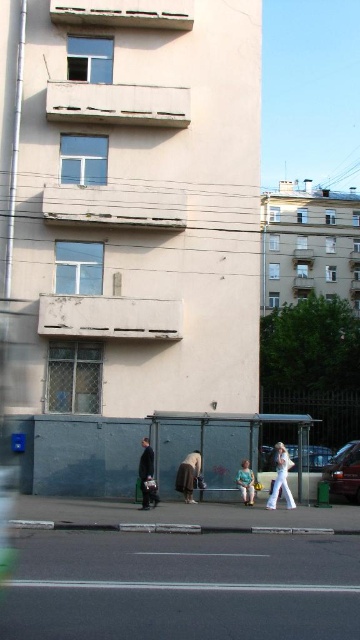
Does metallic silver bus stop at center have a smaller size compared to light blue denim jeans at lower center?

Incorrect, metallic silver bus stop at center is not smaller in size than light blue denim jeans at lower center.

Does metallic silver bus stop at center lie behind light blue denim jeans at lower center?

Yes, metallic silver bus stop at center is behind light blue denim jeans at lower center.

Describe the element at coordinates (225, 449) in the screenshot. I see `metallic silver bus stop at center` at that location.

Identify the location of metallic silver bus stop at center. The width and height of the screenshot is (360, 640). (225, 449).

Does point (270, 468) come closer to viewer compared to point (189, 477)?

No, (270, 468) is behind (189, 477).

Is metallic silver car at center positioned behind brown fabric skirt at center?

Yes.

Describe the element at coordinates (312, 467) in the screenshot. I see `metallic silver car at center` at that location.

This screenshot has height=640, width=360. I want to click on metallic silver car at center, so click(312, 467).

From the picture: Is dark gray fabric coat at center smaller than light blue denim jeans at lower center?

Incorrect, dark gray fabric coat at center is not smaller in size than light blue denim jeans at lower center.

Does dark gray fabric coat at center have a greater height compared to light blue denim jeans at lower center?

Indeed, dark gray fabric coat at center has a greater height compared to light blue denim jeans at lower center.

Locate an element on the screen. The width and height of the screenshot is (360, 640). dark gray fabric coat at center is located at coordinates pyautogui.click(x=146, y=476).